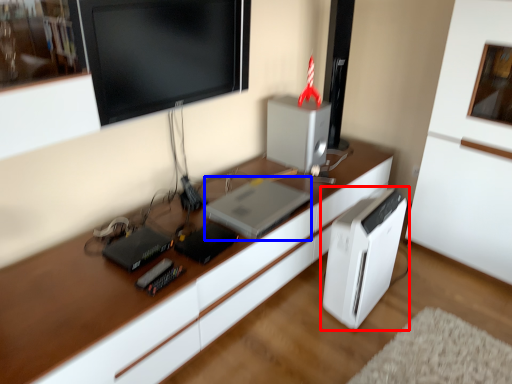
Question: Which point is further to the camera, home appliance (highlighted by a red box) or computer (highlighted by a blue box)?

Choices:
 (A) home appliance
 (B) computer

Answer: (B)